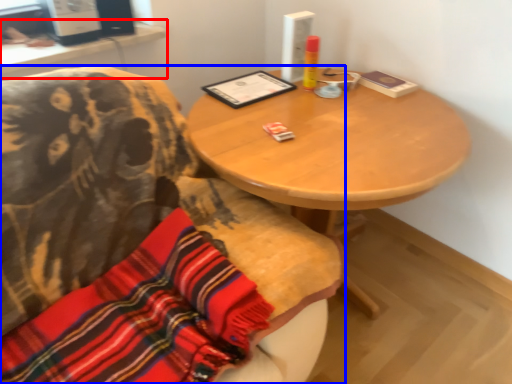
Question: Among these objects, which one is nearest to the camera, computer desk (highlighted by a red box) or chair (highlighted by a blue box)?

Choices:
 (A) computer desk
 (B) chair

Answer: (B)